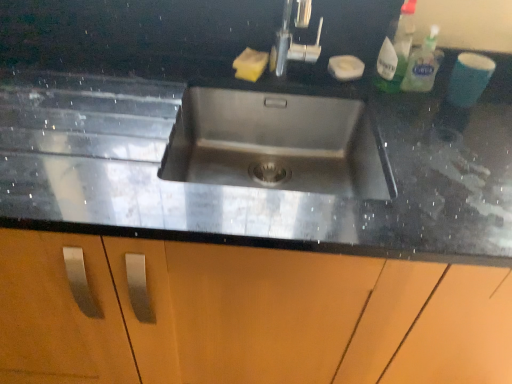
The image size is (512, 384). Find the location of `vacant space in front of clear plastic bottle at upper right, marked as the 1th cleaning product in a right-to-left arrangement`. vacant space in front of clear plastic bottle at upper right, marked as the 1th cleaning product in a right-to-left arrangement is located at coordinates (432, 120).